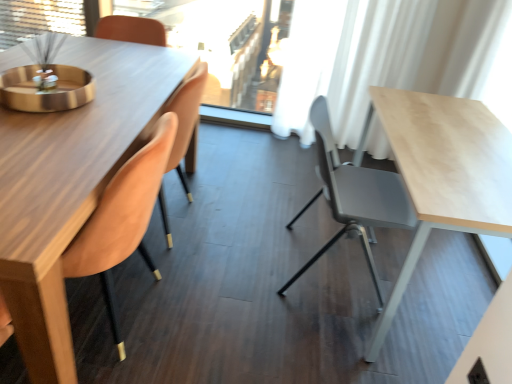
Locate an element on the screen. The height and width of the screenshot is (384, 512). white sheer curtain at upper center is located at coordinates (224, 43).

This screenshot has height=384, width=512. What are the coordinates of `white sheer curtain at upper center` in the screenshot? It's located at (224, 43).

From a real-world perspective, is white sheer curtain at upper center physically located above or below white sheer curtain at upper right?

In terms of real-world spatial position, white sheer curtain at upper center is below white sheer curtain at upper right.

Between point (225, 10) and point (358, 70), which one is positioned in front?

Point (358, 70)

From their relative heights in the image, would you say white sheer curtain at upper center is taller or shorter than white sheer curtain at upper right?

In the image, white sheer curtain at upper center appears to be shorter than white sheer curtain at upper right.

Is white sheer curtain at upper center in front of or behind white sheer curtain at upper right in the image?

white sheer curtain at upper center is behind white sheer curtain at upper right.

From the image's perspective, between matte gray chair at center, which is the 1th chair from right to left, and white sheer curtain at upper center, who is located below?

matte gray chair at center, which is the 1th chair from right to left, is shown below in the image.

Considering the relative positions of matte gray chair at center, the 2th chair positioned from the left, and white sheer curtain at upper center in the image provided, is matte gray chair at center, the 2th chair positioned from the left, to the left of white sheer curtain at upper center from the viewer's perspective?

No, matte gray chair at center, the 2th chair positioned from the left, is not to the left of white sheer curtain at upper center.

Is matte gray chair at center, the 2th chair positioned from the left, inside or outside of white sheer curtain at upper center?

matte gray chair at center, the 2th chair positioned from the left, is outside white sheer curtain at upper center.

Who is more distant, matte gray chair at center, the 2th chair positioned from the left, or white sheer curtain at upper center?

white sheer curtain at upper center is further from the camera.

Is white sheer curtain at upper center taller or shorter than matte gray chair at center, the 2th chair positioned from the left?

Clearly, white sheer curtain at upper center is taller compared to matte gray chair at center, the 2th chair positioned from the left.

Is white sheer curtain at upper center completely or partially outside of matte gray chair at center, the 2th chair positioned from the left?

Yes, white sheer curtain at upper center is outside of matte gray chair at center, the 2th chair positioned from the left.

What's the angular difference between white sheer curtain at upper center and matte gray chair at center, which is the 1th chair from right to left,'s facing directions?

The angle between the facing direction of white sheer curtain at upper center and the facing direction of matte gray chair at center, which is the 1th chair from right to left, is 77 degrees.

You are a GUI agent. You are given a task and a screenshot of the screen. Output one action in this format:
    pyautogui.click(x=<x>, y=<y>)
    Task: Click on the 1st chair in front of the white sheer curtain at upper center, counting from the anchor's position
    
    Given the screenshot: What is the action you would take?
    pyautogui.click(x=354, y=195)

From a real-world perspective, who is located higher, velvet orange chair at left, which appears as the 1th chair when viewed from the left, or matte gray chair at center, the 2th chair positioned from the left?

From a 3D spatial view, velvet orange chair at left, which appears as the 1th chair when viewed from the left, is above.

Could you measure the distance between velvet orange chair at left, the 2th chair when ordered from right to left, and matte gray chair at center, which is the 1th chair from right to left?

37.31 inches.

From the image's perspective, between velvet orange chair at left, the 2th chair when ordered from right to left, and matte gray chair at center, which is the 1th chair from right to left, which one is located above?

matte gray chair at center, which is the 1th chair from right to left, from the image's perspective.

Find the location of a particular element. chair that is under the velvet orange chair at left, which appears as the 1th chair when viewed from the left (from a real-world perspective) is located at coordinates pos(354,195).

Is matte gray chair at center, which is the 1th chair from right to left, taller or shorter than velvet orange chair at left, the 2th chair when ordered from right to left?

In the image, matte gray chair at center, which is the 1th chair from right to left, appears to be shorter than velvet orange chair at left, the 2th chair when ordered from right to left.

Does matte gray chair at center, which is the 1th chair from right to left, have a smaller size compared to velvet orange chair at left, the 2th chair when ordered from right to left?

Indeed, matte gray chair at center, which is the 1th chair from right to left, has a smaller size compared to velvet orange chair at left, the 2th chair when ordered from right to left.

Are matte gray chair at center, the 2th chair positioned from the left, and velvet orange chair at left, which appears as the 1th chair when viewed from the left, making contact?

They are not placed beside each other.

In the image, is white sheer curtain at upper right positioned in front of or behind white sheer curtain at upper center?

Visually, white sheer curtain at upper right is located in front of white sheer curtain at upper center.

Based on their positions, is white sheer curtain at upper right located to the left or right of white sheer curtain at upper center?

Clearly, white sheer curtain at upper right is on the right of white sheer curtain at upper center in the image.

Measure the distance from white sheer curtain at upper right to white sheer curtain at upper center.

They are 34.86 inches apart.

Are white sheer curtain at upper right and white sheer curtain at upper center located far from each other?

They are positioned close to each other.

Between point (27, 360) and point (351, 102), which one is positioned in front?

The point (27, 360) is more forward.

Is velvet orange chair at left, the 2th chair when ordered from right to left, far away from white sheer curtain at upper right?

Indeed, velvet orange chair at left, the 2th chair when ordered from right to left, is not near white sheer curtain at upper right.

Consider the image. Does velvet orange chair at left, the 2th chair when ordered from right to left, lie behind white sheer curtain at upper right?

No, it is not.

From the image's perspective, is velvet orange chair at left, the 2th chair when ordered from right to left, on white sheer curtain at upper right?

No, from the image's perspective, velvet orange chair at left, the 2th chair when ordered from right to left, is not on top of white sheer curtain at upper right.

Locate an element on the screen. Image resolution: width=512 pixels, height=384 pixels. window screen behind the white sheer curtain at upper right is located at coordinates (224, 43).

Which chair is the 1st one when counting from the front of the white sheer curtain at upper center? Please provide its 2D coordinates.

[(354, 195)]

Which object lies nearer to the anchor point white sheer curtain at upper center, velvet orange chair at left, the 2th chair when ordered from right to left, or matte gray chair at center, which is the 1th chair from right to left?

The object closer to white sheer curtain at upper center is matte gray chair at center, which is the 1th chair from right to left.

Looking at the image, which one is located further to white sheer curtain at upper right, white sheer curtain at upper center or velvet orange chair at left, which appears as the 1th chair when viewed from the left?

The object further to white sheer curtain at upper right is velvet orange chair at left, which appears as the 1th chair when viewed from the left.

Estimate the real-world distances between objects in this image. Which object is closer to velvet orange chair at left, the 2th chair when ordered from right to left, white sheer curtain at upper right or matte gray chair at center, the 2th chair positioned from the left?

Based on the image, matte gray chair at center, the 2th chair positioned from the left, appears to be nearer to velvet orange chair at left, the 2th chair when ordered from right to left.

Based on their spatial positions, is matte gray chair at center, which is the 1th chair from right to left, or white sheer curtain at upper center closer to white sheer curtain at upper right?

Among the two, white sheer curtain at upper center is located nearer to white sheer curtain at upper right.

Looking at the image, which one is located closer to white sheer curtain at upper center, white sheer curtain at upper right or matte gray chair at center, which is the 1th chair from right to left?

white sheer curtain at upper right is closer to white sheer curtain at upper center.

Considering their positions, is white sheer curtain at upper center positioned further to white sheer curtain at upper right than matte gray chair at center, which is the 1th chair from right to left?

matte gray chair at center, which is the 1th chair from right to left.

When comparing their distances from white sheer curtain at upper center, does matte gray chair at center, which is the 1th chair from right to left, or white sheer curtain at upper right seem further?

Among the two, matte gray chair at center, which is the 1th chair from right to left, is located further to white sheer curtain at upper center.

In the scene shown: Which object lies further to the anchor point matte gray chair at center, which is the 1th chair from right to left, velvet orange chair at left, the 2th chair when ordered from right to left, or white sheer curtain at upper right?

The object further to matte gray chair at center, which is the 1th chair from right to left, is white sheer curtain at upper right.

At what (x,y) coordinates should I click in order to perform the action: click on chair between velvet orange chair at left, which appears as the 1th chair when viewed from the left, and white sheer curtain at upper center from front to back. Please return your answer as a coordinate pair (x, y). Looking at the image, I should click on (354, 195).

At what (x,y) coordinates should I click in order to perform the action: click on chair between velvet orange chair at left, the 2th chair when ordered from right to left, and white sheer curtain at upper right in the front-back direction. Please return your answer as a coordinate pair (x, y). The width and height of the screenshot is (512, 384). Looking at the image, I should click on (354, 195).

The image size is (512, 384). Identify the location of curtain between matte gray chair at center, which is the 1th chair from right to left, and white sheer curtain at upper center, along the z-axis. (375, 57).

Locate an element on the screen. curtain between velvet orange chair at left, the 2th chair when ordered from right to left, and white sheer curtain at upper center from front to back is located at coordinates (375, 57).